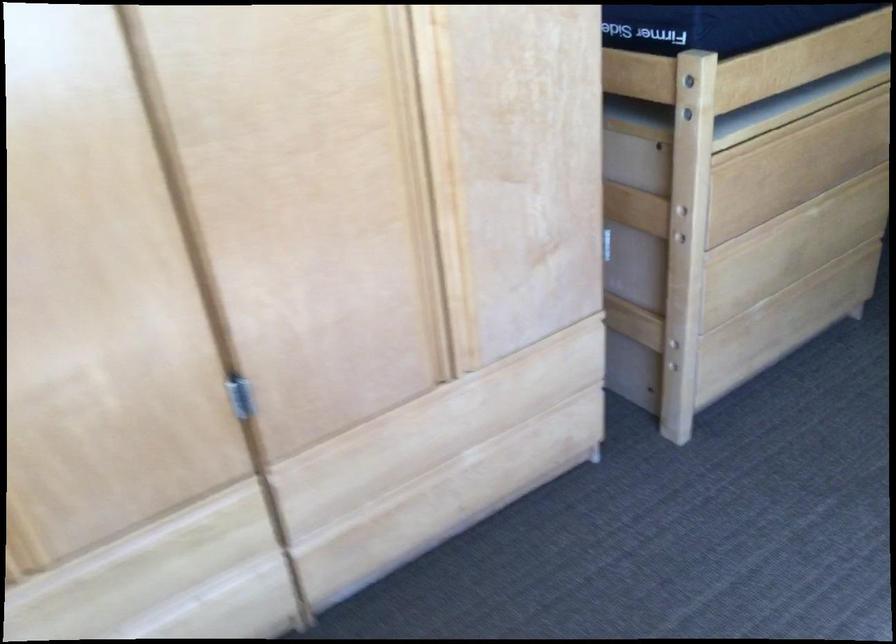
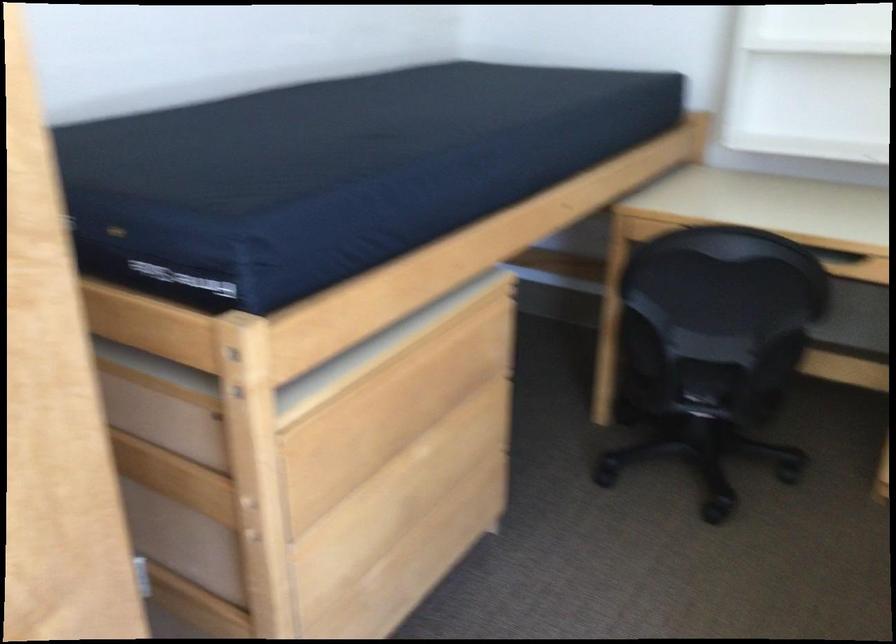
Find the pixel in the second image that matches pixel 802 131 in the first image.

(403, 379)